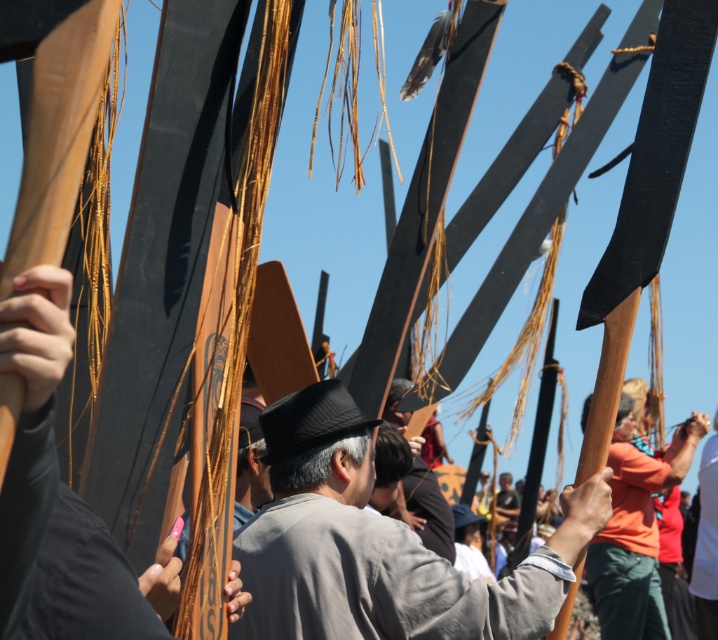
Question: Does gray fabric shirt at center have a greater width compared to smooth brown leather jacket at lower right?

Choices:
 (A) yes
 (B) no

Answer: (B)

Question: Which point is closer to the camera?

Choices:
 (A) orange t-shirt at right
 (B) gray fabric shirt at center
 (C) wooden board at center

Answer: (C)

Question: Which point is farther from the camera taking this photo?

Choices:
 (A) (47, 269)
 (B) (279, 406)
 (C) (704, 525)

Answer: (C)

Question: Is wooden board at center above black textured hat at center?

Choices:
 (A) no
 (B) yes

Answer: (A)

Question: Is gray fabric shirt at center positioned in front of dark gray fabric hat at center?

Choices:
 (A) yes
 (B) no

Answer: (A)

Question: Which object is the closest to the dark gray fabric hat at center?

Choices:
 (A) smooth brown leather jacket at lower right
 (B) black textured hat at center

Answer: (A)